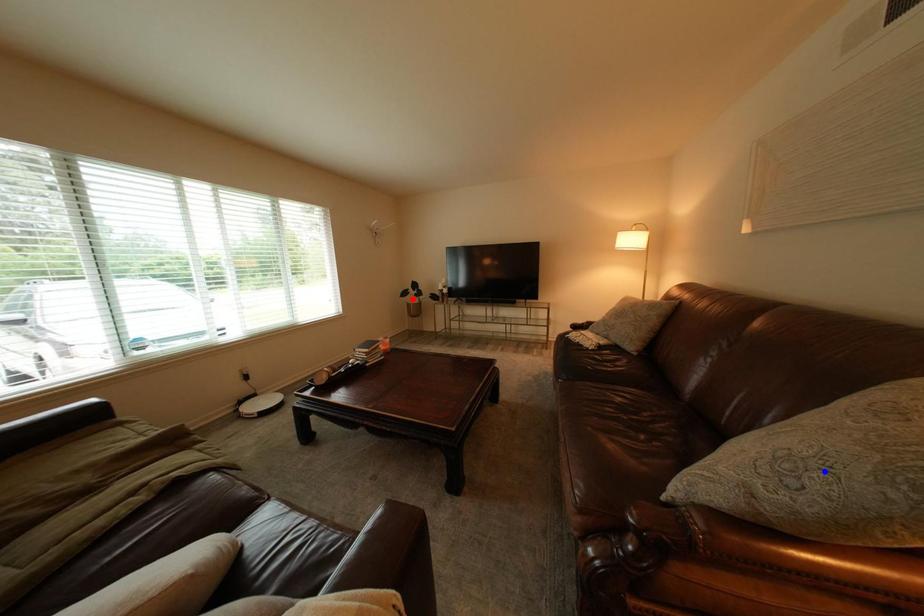
Question: In the image, two points are highlighted. Which point is nearer to the camera? Reply with the corresponding letter.

Choices:
 (A) blue point
 (B) red point

Answer: (A)